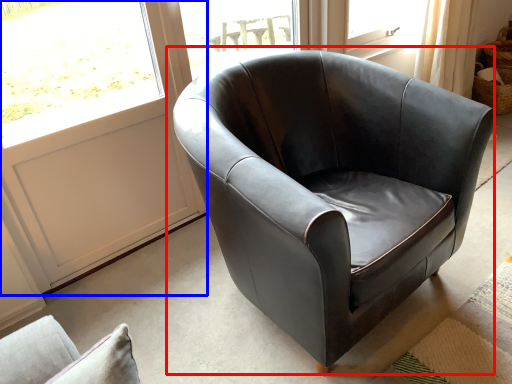
Question: Which object appears closest to the camera in this image, chair (highlighted by a red box) or screen door (highlighted by a blue box)?

Choices:
 (A) chair
 (B) screen door

Answer: (A)